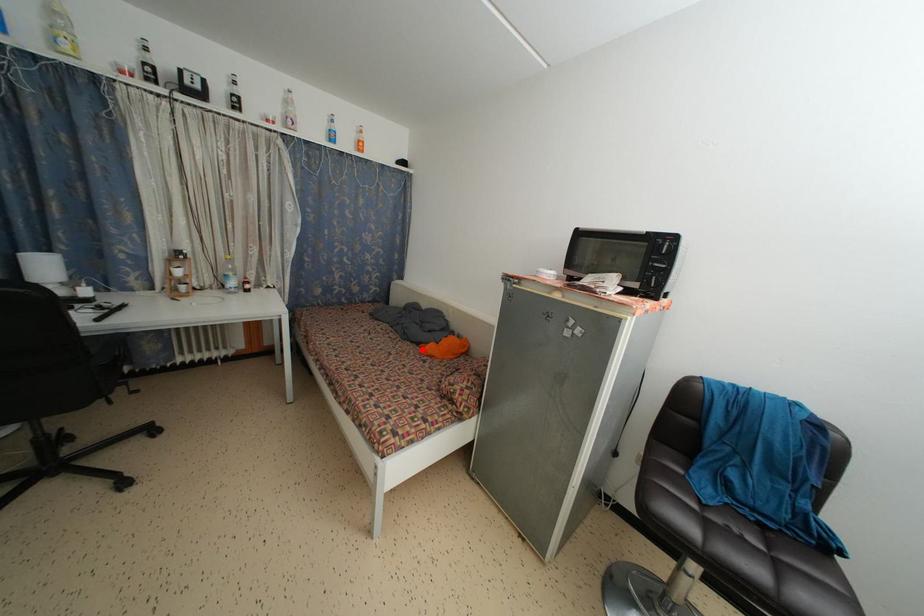
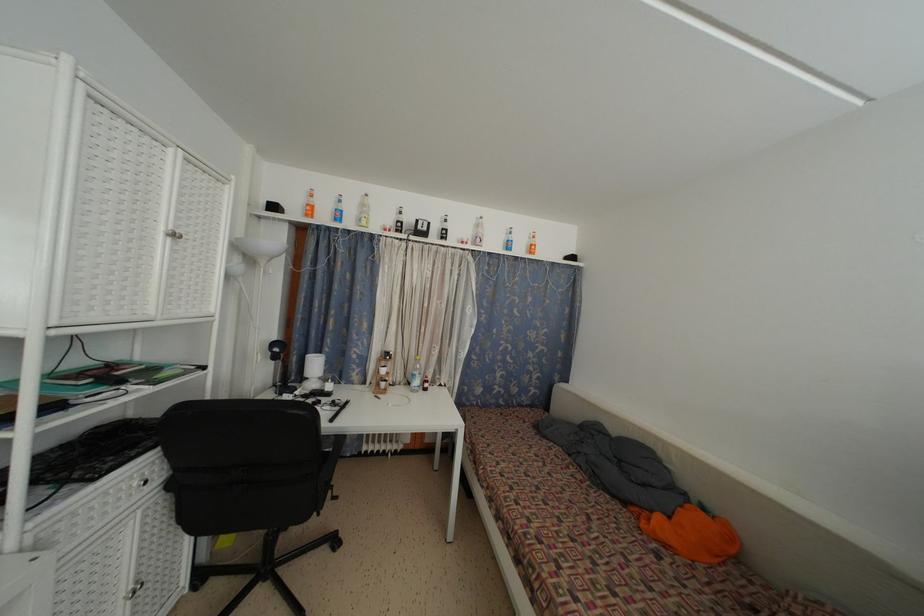
Question: I am providing you with two images of the same scene from different viewpoints. A red point is shown in image1. For the corresponding object point in image2, is it positioned nearer or farther from the camera?

Choices:
 (A) Nearer
 (B) Farther

Answer: (A)